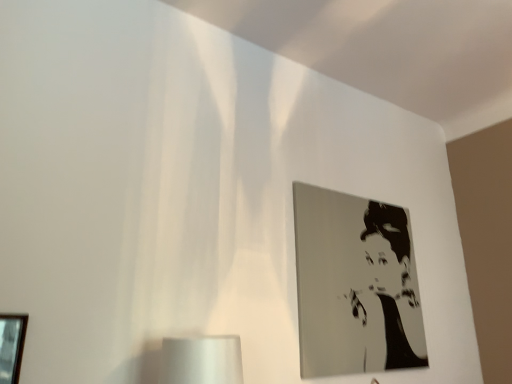
Question: Considering the positions of wooden picture frame at lower left, marked as the first picture frame in a left-to-right arrangement, and metallic silver portrait at upper right, acting as the 2th picture frame starting from the left, in the image, is wooden picture frame at lower left, marked as the first picture frame in a left-to-right arrangement, bigger or smaller than metallic silver portrait at upper right, acting as the 2th picture frame starting from the left,?

Choices:
 (A) small
 (B) big

Answer: (A)

Question: Looking at their shapes, would you say wooden picture frame at lower left, the 2th picture frame viewed from the right, is wider or thinner than metallic silver portrait at upper right, arranged as the 1th picture frame when viewed from the back?

Choices:
 (A) thin
 (B) wide

Answer: (A)

Question: In the image, is wooden picture frame at lower left, the first picture frame viewed from the front, on the left side or the right side of metallic silver portrait at upper right, placed as the second picture frame when sorted from front to back?

Choices:
 (A) left
 (B) right

Answer: (A)

Question: In the image, is metallic silver portrait at upper right, acting as the 2th picture frame starting from the left, on the left side or the right side of wooden picture frame at lower left, the first picture frame viewed from the front?

Choices:
 (A) left
 (B) right

Answer: (B)

Question: In the image, is metallic silver portrait at upper right, placed as the second picture frame when sorted from front to back, positioned in front of or behind wooden picture frame at lower left, the first picture frame viewed from the front?

Choices:
 (A) front
 (B) behind

Answer: (B)

Question: Considering the positions of metallic silver portrait at upper right, arranged as the 1th picture frame when viewed from the back, and wooden picture frame at lower left, acting as the second picture frame starting from the back, in the image, is metallic silver portrait at upper right, arranged as the 1th picture frame when viewed from the back, bigger or smaller than wooden picture frame at lower left, acting as the second picture frame starting from the back,?

Choices:
 (A) small
 (B) big

Answer: (B)

Question: Considering the positions of metallic silver portrait at upper right, placed as the second picture frame when sorted from front to back, and wooden picture frame at lower left, the 2th picture frame viewed from the right, in the image, is metallic silver portrait at upper right, placed as the second picture frame when sorted from front to back, taller or shorter than wooden picture frame at lower left, the 2th picture frame viewed from the right,?

Choices:
 (A) tall
 (B) short

Answer: (A)